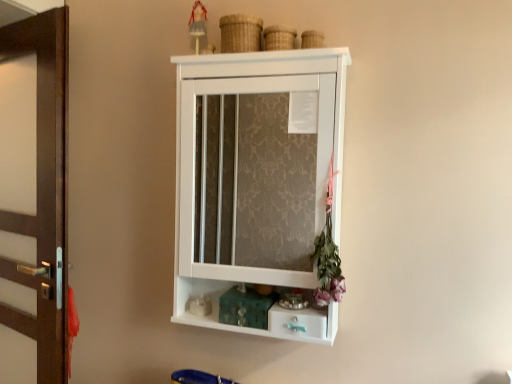
Question: Does white matte figurine at lower center, placed as the 2th toy when sorted from top to bottom, have a larger size compared to purple fabric flower at right?

Choices:
 (A) yes
 (B) no

Answer: (B)

Question: From the image's perspective, is white matte figurine at lower center, the first toy positioned from the bottom, located beneath purple fabric flower at right?

Choices:
 (A) yes
 (B) no

Answer: (A)

Question: Does white matte figurine at lower center, placed as the 2th toy when sorted from top to bottom, lie in front of purple fabric flower at right?

Choices:
 (A) yes
 (B) no

Answer: (B)

Question: Is white matte figurine at lower center, the first toy positioned from the bottom, looking in the opposite direction of purple fabric flower at right?

Choices:
 (A) no
 (B) yes

Answer: (A)

Question: Considering the relative sizes of white matte figurine at lower center, placed as the 2th toy when sorted from top to bottom, and purple fabric flower at right in the image provided, is white matte figurine at lower center, placed as the 2th toy when sorted from top to bottom, shorter than purple fabric flower at right?

Choices:
 (A) yes
 (B) no

Answer: (A)

Question: Does white matte figurine at lower center, placed as the 2th toy when sorted from top to bottom, appear on the right side of purple fabric flower at right?

Choices:
 (A) yes
 (B) no

Answer: (B)

Question: Is white matte cabinet at center facing away from brown wood door at left?

Choices:
 (A) no
 (B) yes

Answer: (A)

Question: Is white matte cabinet at center facing towards brown wood door at left?

Choices:
 (A) yes
 (B) no

Answer: (B)

Question: Can you confirm if white matte cabinet at center is smaller than brown wood door at left?

Choices:
 (A) no
 (B) yes

Answer: (A)

Question: Can you confirm if white matte cabinet at center is taller than brown wood door at left?

Choices:
 (A) yes
 (B) no

Answer: (B)

Question: Does white matte cabinet at center have a larger size compared to brown wood door at left?

Choices:
 (A) no
 (B) yes

Answer: (B)

Question: Is white matte cabinet at center further to camera compared to brown wood door at left?

Choices:
 (A) no
 (B) yes

Answer: (A)

Question: From a real-world perspective, is teal glossy drawer at lower center over white matte figurine at lower center, placed as the 2th toy when sorted from top to bottom?

Choices:
 (A) yes
 (B) no

Answer: (A)